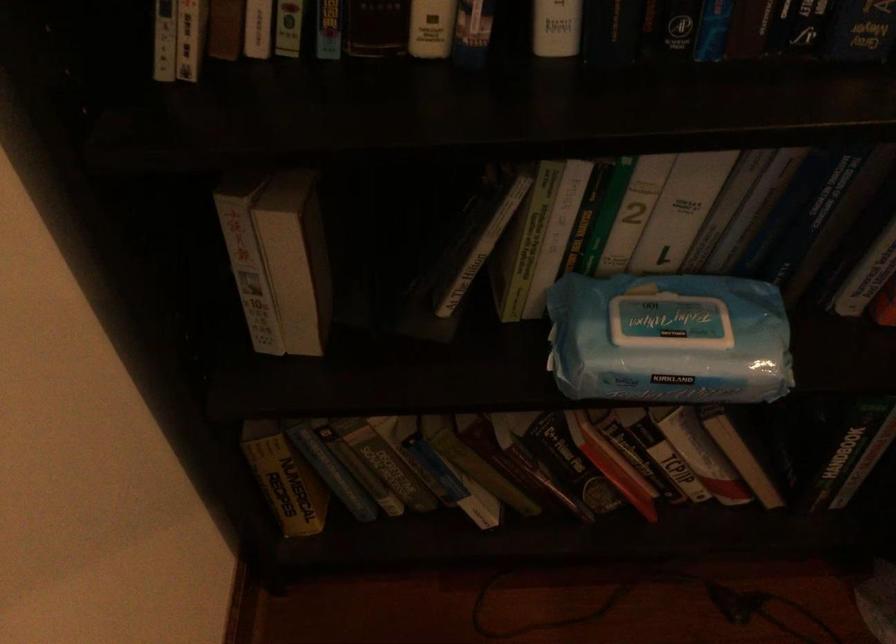
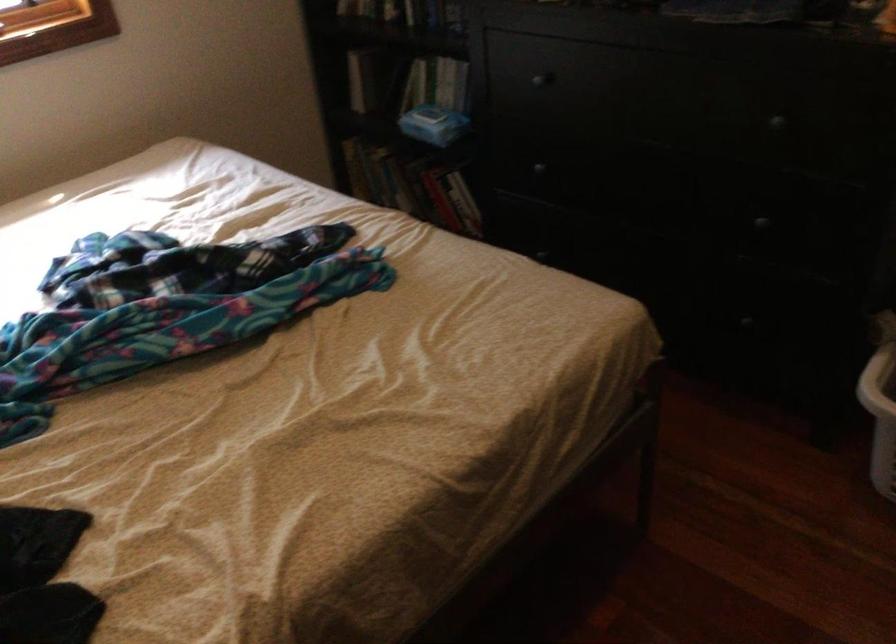
Locate, in the second image, the point that corresponds to (702,357) in the first image.

(433, 124)